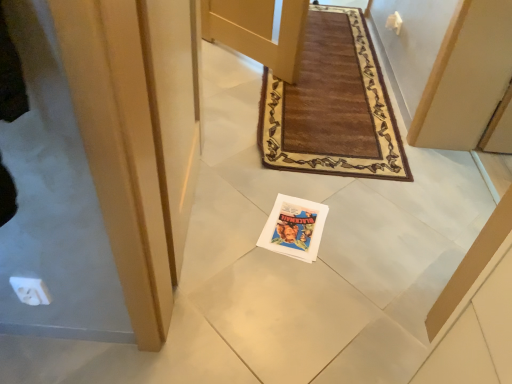
Question: From a real-world perspective, is matte paper magazine at center above or below matte wood door at center?

Choices:
 (A) below
 (B) above

Answer: (A)

Question: Based on their sizes in the image, would you say matte paper magazine at center is bigger or smaller than matte wood door at center?

Choices:
 (A) big
 (B) small

Answer: (B)

Question: Is matte paper magazine at center taller or shorter than matte wood door at center?

Choices:
 (A) tall
 (B) short

Answer: (B)

Question: Is point (414, 142) positioned closer to the camera than point (269, 213)?

Choices:
 (A) closer
 (B) farther

Answer: (B)

Question: Is matte wood door at center spatially inside matte paper magazine at center, or outside of it?

Choices:
 (A) outside
 (B) inside

Answer: (A)

Question: In terms of height, does matte wood door at center look taller or shorter compared to matte paper magazine at center?

Choices:
 (A) tall
 (B) short

Answer: (A)

Question: Considering their positions, is matte wood door at center located in front of or behind matte paper magazine at center?

Choices:
 (A) behind
 (B) front

Answer: (B)